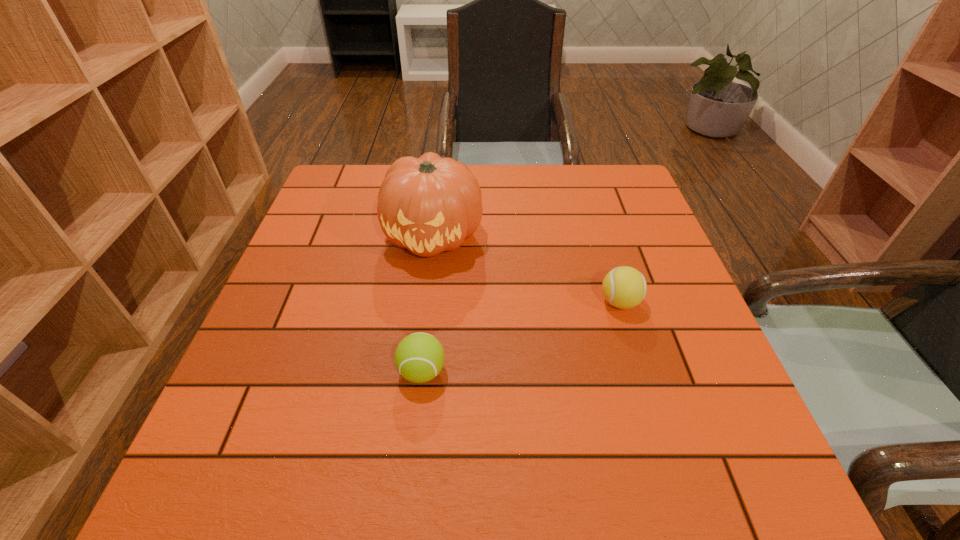
The image size is (960, 540). In order to click on object that is positioned at the right edge in this screenshot , I will do `click(624, 287)`.

In the image, there is a desktop. Where is `vacant region at the far edge`? vacant region at the far edge is located at coordinates (563, 183).

Find the location of `vacant space at the near edge of the desktop`. vacant space at the near edge of the desktop is located at coordinates (391, 494).

Find the location of `vacant area at the left edge`. vacant area at the left edge is located at coordinates (349, 234).

In the image, there is a desktop. Where is `free space at the right edge`? The image size is (960, 540). free space at the right edge is located at coordinates (664, 322).

Where is `vacant area at the far left corner`? vacant area at the far left corner is located at coordinates (345, 182).

This screenshot has width=960, height=540. What are the coordinates of `vacant area at the far right corner` in the screenshot? It's located at (612, 176).

Image resolution: width=960 pixels, height=540 pixels. I want to click on vacant space that's between the tallest object and the nearer tennis ball, so click(x=428, y=303).

Where is `vacant area that lies between the second farthest object and the nearer tennis ball`? vacant area that lies between the second farthest object and the nearer tennis ball is located at coordinates (521, 337).

Find the location of `vacant point located between the nearer tennis ball and the farthest object`. vacant point located between the nearer tennis ball and the farthest object is located at coordinates (428, 303).